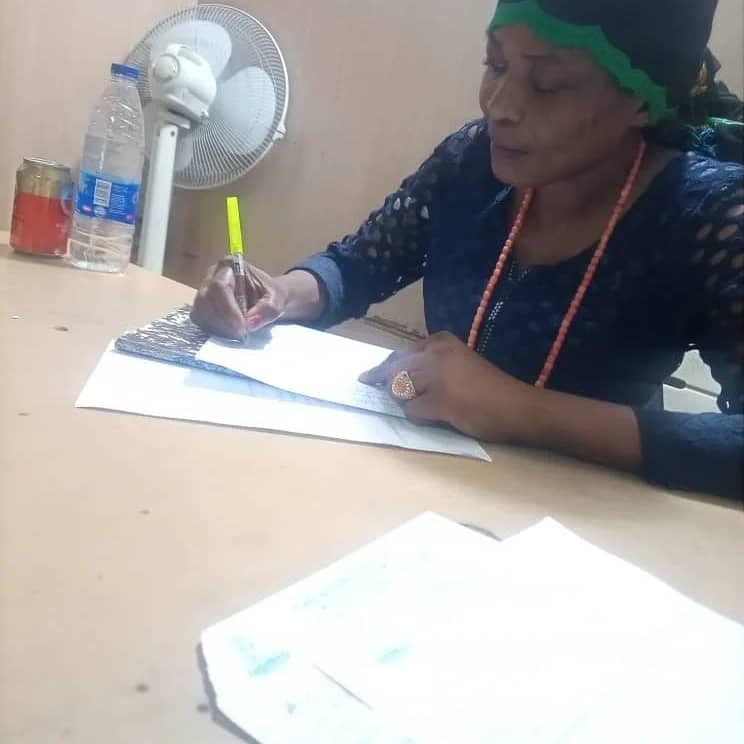
Where is `pen`? This screenshot has height=744, width=744. pen is located at coordinates (231, 253).